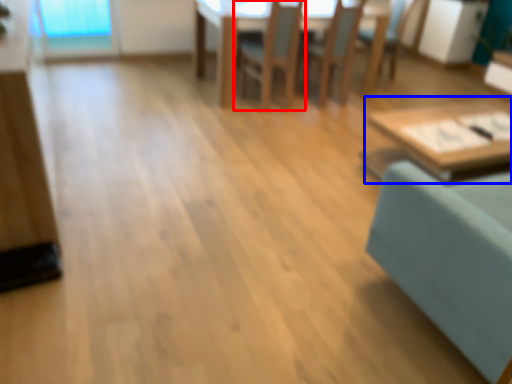
Question: Which object is further to the camera taking this photo, chair (highlighted by a red box) or table (highlighted by a blue box)?

Choices:
 (A) chair
 (B) table

Answer: (A)